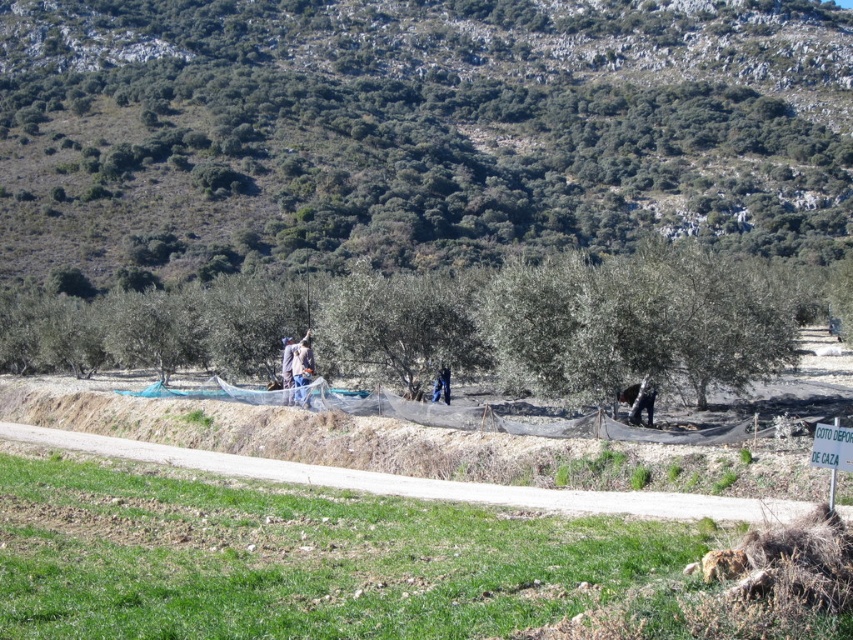
Which is in front, point (112, 67) or point (451, 493)?

Point (451, 493) is in front.

This screenshot has height=640, width=853. What do you see at coordinates (415, 131) in the screenshot?
I see `green leafy hillside at upper center` at bounding box center [415, 131].

The width and height of the screenshot is (853, 640). In order to click on green leafy hillside at upper center in this screenshot , I will do `click(415, 131)`.

Is blue jeans at center smaller than denim pants at center?

Actually, blue jeans at center might be larger than denim pants at center.

You are a GUI agent. You are given a task and a screenshot of the screen. Output one action in this format:
    pyautogui.click(x=<x>, y=<y>)
    Task: Click on the blue jeans at center
    This screenshot has width=853, height=640.
    Given the screenshot: What is the action you would take?
    coord(299,369)

Between point (297, 362) and point (648, 403), which one is positioned behind?

Point (297, 362)

At what (x,y) coordinates should I click in order to perform the action: click on blue jeans at center. Please return your answer as a coordinate pair (x, y). Looking at the image, I should click on [x=299, y=369].

Does denim pants at center have a larger size compared to blue denim jeans at center?

Correct, denim pants at center is larger in size than blue denim jeans at center.

Measure the distance between denim pants at center and blue denim jeans at center.

denim pants at center and blue denim jeans at center are 27.14 feet apart from each other.

This screenshot has height=640, width=853. Identify the location of denim pants at center. (639, 401).